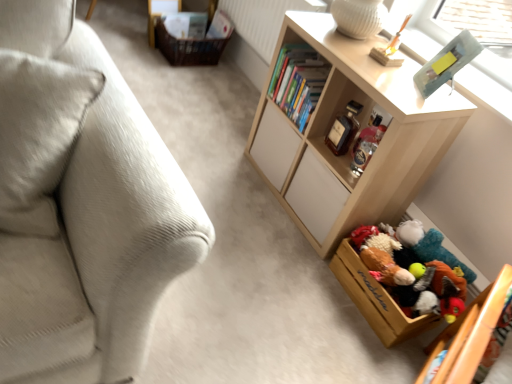
Question: Is point (374, 165) positioned closer to the camera than point (395, 302)?

Choices:
 (A) farther
 (B) closer

Answer: (B)

Question: In the image, is light wood shelf at center on the left side or the right side of wooden toy box at lower right, which appears as the 1th storage box when ordered from the bottom?

Choices:
 (A) right
 (B) left

Answer: (B)

Question: Which object is the farthest from the brown woven basket at upper left, acting as the second storage box starting from the bottom?

Choices:
 (A) white textured radiator at upper center
 (B) light wood shelf at center
 (C) wooden toy box at lower right, arranged as the 2th storage box when viewed from the back
 (D) metallic gray frame at upper right
 (E) light beige fabric couch at left

Answer: (E)

Question: Which object is positioned farthest from the light beige fabric couch at left?

Choices:
 (A) white textured radiator at upper center
 (B) metallic gray frame at upper right
 (C) light wood shelf at center
 (D) brown woven basket at upper left, the second storage box from the right
 (E) wooden toy box at lower right, arranged as the 2th storage box when viewed from the back

Answer: (D)